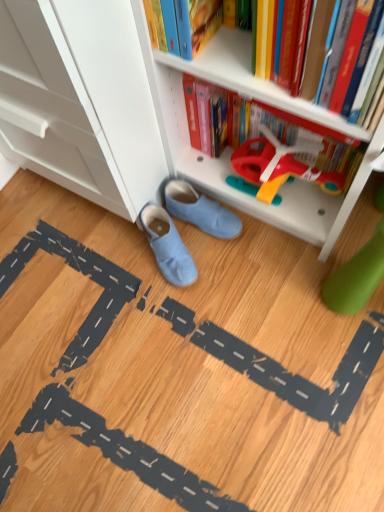
Find the location of a particular element. The image size is (384, 512). free spot in front of suede-like blue slippers at center, the 2th footwear in the bottom-to-top sequence is located at coordinates (225, 286).